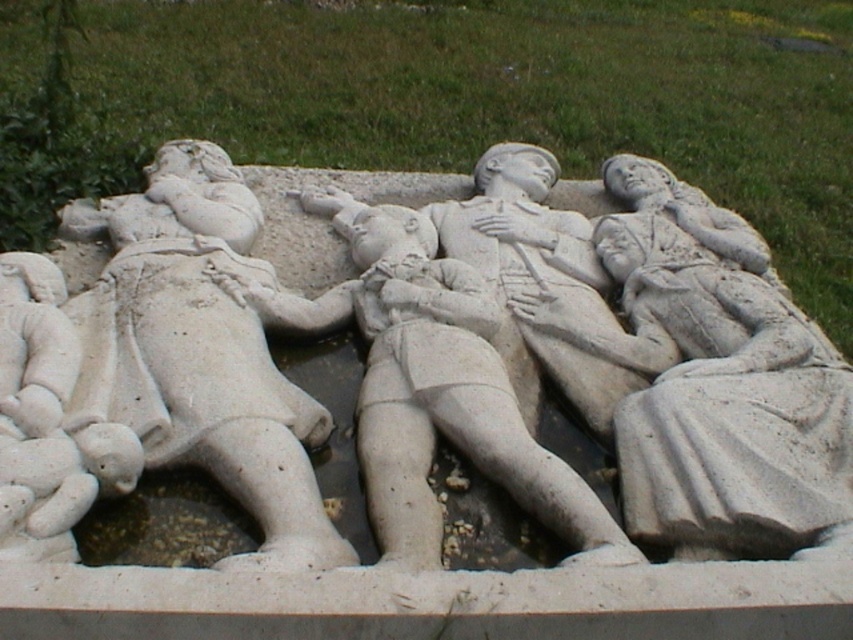
Can you confirm if white stone sculpture at center is bigger than white stone figure at center?

Indeed, white stone sculpture at center has a larger size compared to white stone figure at center.

Does white stone sculpture at center have a lesser width compared to white stone figure at center?

No, white stone sculpture at center is not thinner than white stone figure at center.

This screenshot has width=853, height=640. What do you see at coordinates (422, 362) in the screenshot? I see `white stone sculpture at center` at bounding box center [422, 362].

Identify the location of white stone sculpture at center. This screenshot has width=853, height=640. (422, 362).

You are a GUI agent. You are given a task and a screenshot of the screen. Output one action in this format:
    pyautogui.click(x=<x>, y=<y>)
    Task: Click on the white stone sculpture at center
    The height and width of the screenshot is (640, 853).
    Given the screenshot: What is the action you would take?
    pyautogui.click(x=422, y=362)

Who is more forward, (x=631, y=304) or (x=274, y=524)?

Positioned in front is point (x=274, y=524).

At what (x,y) coordinates should I click in order to perform the action: click on white stone sculpture at center. Please return your answer as a coordinate pair (x, y). Looking at the image, I should click on (422, 362).

Is white stone figure at left closer to camera compared to white stone figure at center?

Yes, white stone figure at left is in front of white stone figure at center.

Does white stone figure at left have a greater height compared to white stone figure at center?

Yes, white stone figure at left is taller than white stone figure at center.

Identify the location of white stone figure at left. (164, 364).